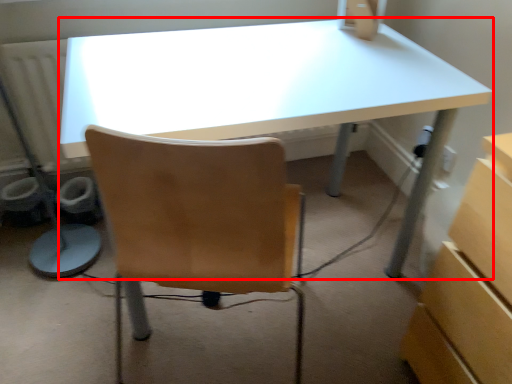
Question: Considering the relative positions of desk (annotated by the red box) and desktop computer in the image provided, where is desk (annotated by the red box) located with respect to the staircase?

Choices:
 (A) left
 (B) right

Answer: (A)